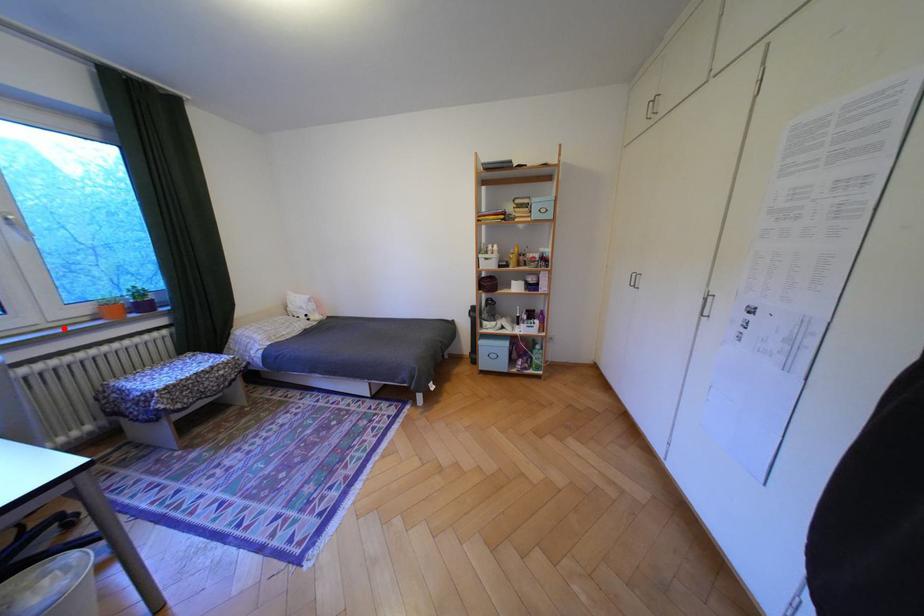
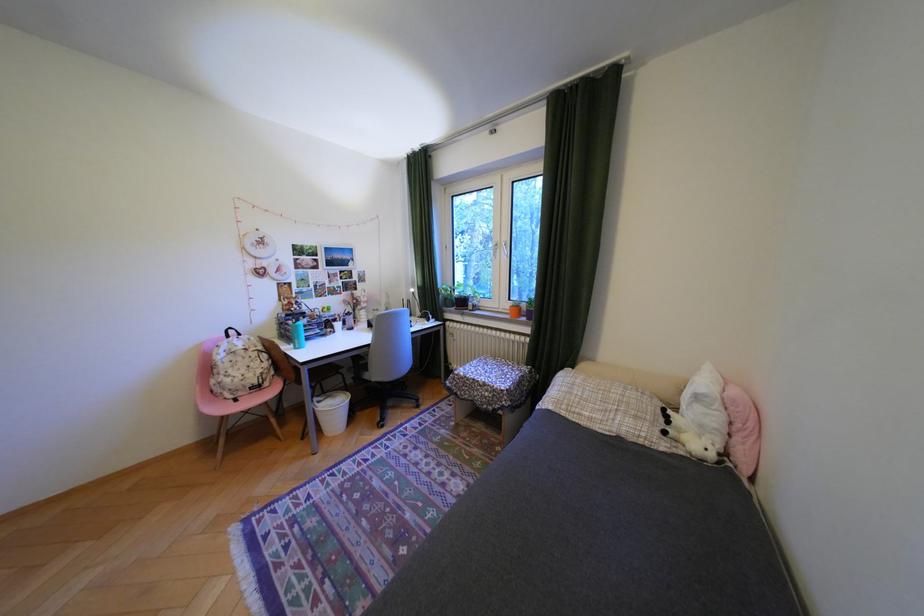
Find the pixel in the second image that matches the highlighted location in the first image.

(514, 313)